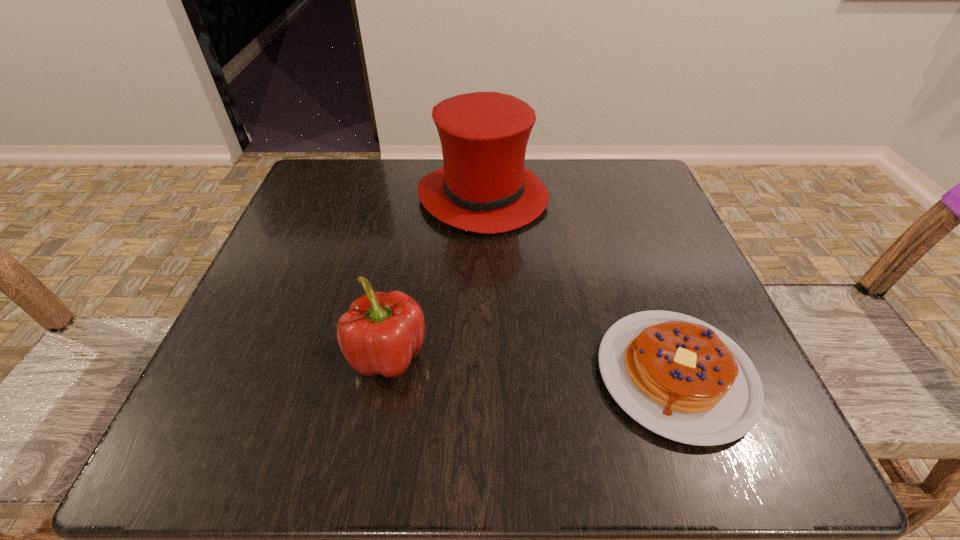
The height and width of the screenshot is (540, 960). Find the location of `object situated at the right edge`. object situated at the right edge is located at coordinates (678, 376).

This screenshot has width=960, height=540. I want to click on object that is at the near right corner, so click(x=678, y=376).

At what (x,y) coordinates should I click in order to perform the action: click on free point at the far edge. Please return your answer as a coordinate pair (x, y). The image size is (960, 540). Looking at the image, I should click on (561, 183).

Where is `vacant space at the near edge`? The width and height of the screenshot is (960, 540). vacant space at the near edge is located at coordinates (569, 435).

Locate an element on the screen. blank space at the left edge of the desktop is located at coordinates (269, 284).

Locate an element on the screen. This screenshot has width=960, height=540. vacant space at the right edge of the desktop is located at coordinates (633, 246).

What are the coordinates of `free location at the far left corner of the desktop` in the screenshot? It's located at (294, 211).

Image resolution: width=960 pixels, height=540 pixels. In the image, there is a desktop. In order to click on vacant space at the near left corner in this screenshot , I will do `click(242, 442)`.

What are the coordinates of `free space at the far right corner of the desktop` in the screenshot? It's located at (634, 169).

Where is `unoccupied area between the rightmost object and the farthest object`? unoccupied area between the rightmost object and the farthest object is located at coordinates (579, 286).